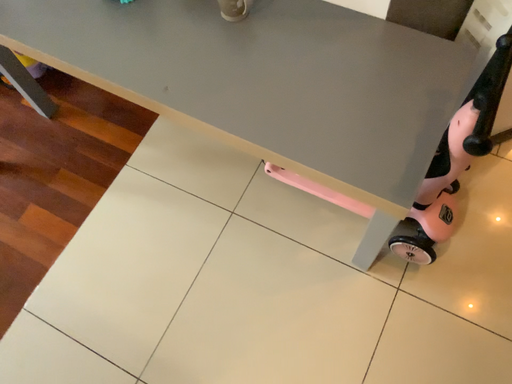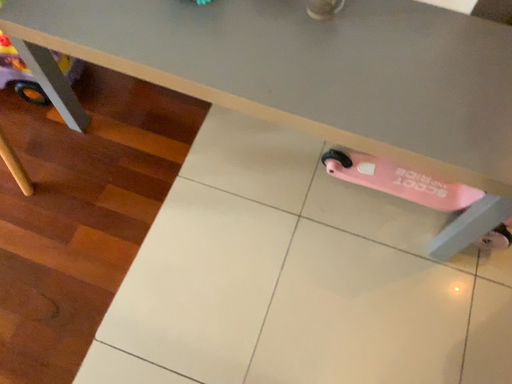
Question: Which way did the camera rotate in the video?

Choices:
 (A) rotated right
 (B) rotated left

Answer: (A)